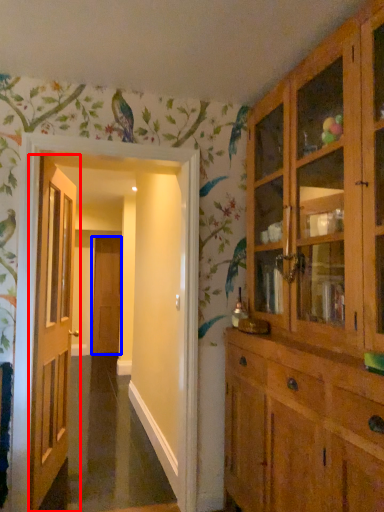
Question: Which point is further to the camera, door (highlighted by a red box) or door (highlighted by a blue box)?

Choices:
 (A) door
 (B) door

Answer: (B)